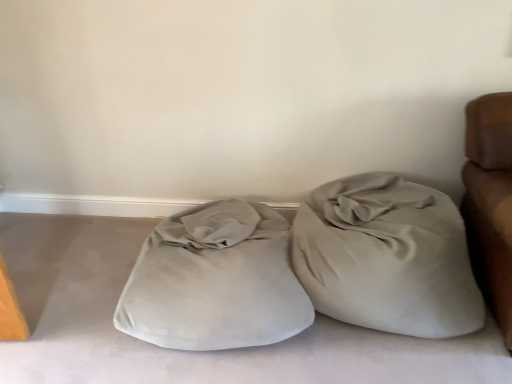
Question: Could suede beige bean bag at right be considered to be inside suede-like beige pillow at center?

Choices:
 (A) no
 (B) yes

Answer: (A)

Question: Is the surface of suede-like beige pillow at center in direct contact with suede beige bean bag at right?

Choices:
 (A) no
 (B) yes

Answer: (A)

Question: Is suede-like beige pillow at center oriented towards suede beige bean bag at right?

Choices:
 (A) yes
 (B) no

Answer: (B)

Question: Is suede-like beige pillow at center in front of suede beige bean bag at right?

Choices:
 (A) yes
 (B) no

Answer: (A)

Question: Is suede-like beige pillow at center not inside suede beige bean bag at right?

Choices:
 (A) yes
 (B) no

Answer: (A)

Question: Is suede-like beige pillow at center further to the viewer compared to suede beige bean bag at right?

Choices:
 (A) yes
 (B) no

Answer: (B)

Question: From the image's perspective, would you say suede beige bean bag at right is shown under suede-like beige pillow at center?

Choices:
 (A) yes
 (B) no

Answer: (B)

Question: Are suede beige bean bag at right and suede-like beige pillow at center far apart?

Choices:
 (A) no
 (B) yes

Answer: (A)

Question: From a real-world perspective, is suede beige bean bag at right under suede-like beige pillow at center?

Choices:
 (A) yes
 (B) no

Answer: (B)

Question: Does suede beige bean bag at right have a larger size compared to suede-like beige pillow at center?

Choices:
 (A) yes
 (B) no

Answer: (B)

Question: Is suede beige bean bag at right to the right of suede-like beige pillow at center from the viewer's perspective?

Choices:
 (A) no
 (B) yes

Answer: (B)

Question: Is suede beige bean bag at right behind suede-like beige pillow at center?

Choices:
 (A) no
 (B) yes

Answer: (B)

Question: Relative to suede-like beige pillow at center, is suede beige bean bag at right in front or behind?

Choices:
 (A) front
 (B) behind

Answer: (B)